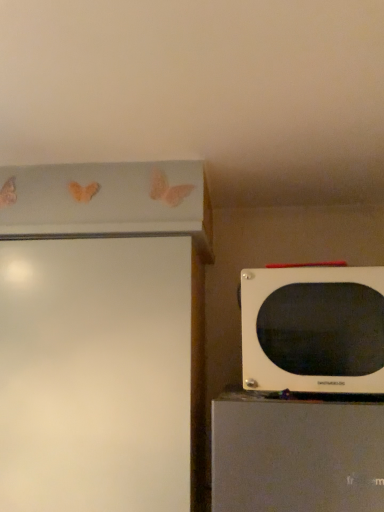
Image resolution: width=384 pixels, height=512 pixels. What do you see at coordinates (95, 374) in the screenshot? I see `white glossy screen door at left` at bounding box center [95, 374].

Measure the distance between white glossy screen door at left and camera.

white glossy screen door at left is 36.99 inches away from camera.

What are the coordinates of `white glossy screen door at left` in the screenshot? It's located at (95, 374).

Locate an element on the screen. The height and width of the screenshot is (512, 384). white matte microwave at right is located at coordinates (313, 329).

Describe the element at coordinates (313, 329) in the screenshot. Image resolution: width=384 pixels, height=512 pixels. I see `white matte microwave at right` at that location.

Find the location of a particular element. This screenshot has width=384, height=512. white glossy screen door at left is located at coordinates (95, 374).

Which object is positioned more to the left, white glossy screen door at left or white matte microwave at right?

white glossy screen door at left.

Is white glossy screen door at left positioned behind white matte microwave at right?

Yes, white glossy screen door at left is further from the viewer.

Is point (86, 350) positioned before point (263, 334)?

No.

Based on the photo, from the image's perspective, is white glossy screen door at left over white matte microwave at right?

Actually, white glossy screen door at left appears below white matte microwave at right in the image.

From a real-world perspective, is white glossy screen door at left physically below white matte microwave at right?

Indeed, from a real-world perspective, white glossy screen door at left is positioned beneath white matte microwave at right.

Considering the sizes of white glossy screen door at left and white matte microwave at right in the image, is white glossy screen door at left wider or thinner than white matte microwave at right?

white glossy screen door at left is wider than white matte microwave at right.

Which of these two, white glossy screen door at left or white matte microwave at right, stands shorter?

With less height is white matte microwave at right.

Between white glossy screen door at left and white matte microwave at right, which one has smaller size?

white matte microwave at right is smaller.

From the picture: Can white matte microwave at right be found inside white glossy screen door at left?

No.

Is white glossy screen door at left not close to white matte microwave at right?

Actually, white glossy screen door at left and white matte microwave at right are a little close together.

Is white glossy screen door at left looking in the opposite direction of white matte microwave at right?

No, white glossy screen door at left is not facing the opposite direction of white matte microwave at right.

How different are the orientations of white glossy screen door at left and white matte microwave at right in degrees?

0.844 degrees separate the facing orientations of white glossy screen door at left and white matte microwave at right.

Measure the distance from white glossy screen door at left to white matte microwave at right.

The distance of white glossy screen door at left from white matte microwave at right is 13.84 inches.

The height and width of the screenshot is (512, 384). Find the location of `microwave oven above the white glossy screen door at left (from the image's perspective)`. microwave oven above the white glossy screen door at left (from the image's perspective) is located at coordinates (313, 329).

Which is more to the right, white matte microwave at right or white glossy screen door at left?

white matte microwave at right.

Is the position of white matte microwave at right less distant than that of white glossy screen door at left?

Yes, white matte microwave at right is closer to the viewer.

Between point (259, 306) and point (92, 455), which one is positioned in front?

The point (259, 306) is closer to the camera.

From the image's perspective, which object appears higher, white matte microwave at right or white glossy screen door at left?

white matte microwave at right, from the image's perspective.

Consider the image. From a real-world perspective, between white matte microwave at right and white glossy screen door at left, who is vertically lower?

white glossy screen door at left, from a real-world perspective.

From the picture: Is white matte microwave at right thinner than white glossy screen door at left?

Yes.

Who is taller, white matte microwave at right or white glossy screen door at left?

Standing taller between the two is white glossy screen door at left.

Which of these two, white matte microwave at right or white glossy screen door at left, is smaller?

white matte microwave at right is smaller.

Is white glossy screen door at left surrounded by white matte microwave at right?

Definitely not — white glossy screen door at left is not inside white matte microwave at right.

Is white matte microwave at right not close to white glossy screen door at left?

They are positioned close to each other.

Is white matte microwave at right turned away from white glossy screen door at left?

No, white glossy screen door at left is not at the back of white matte microwave at right.

What are the coordinates of `microwave oven above the white glossy screen door at left (from the image's perspective)` in the screenshot? It's located at (313, 329).

In the image, there is a white matte microwave at right. In order to click on screen door below it (from a real-world perspective) in this screenshot , I will do `click(95, 374)`.

Image resolution: width=384 pixels, height=512 pixels. Identify the location of screen door that is behind the white matte microwave at right. (95, 374).